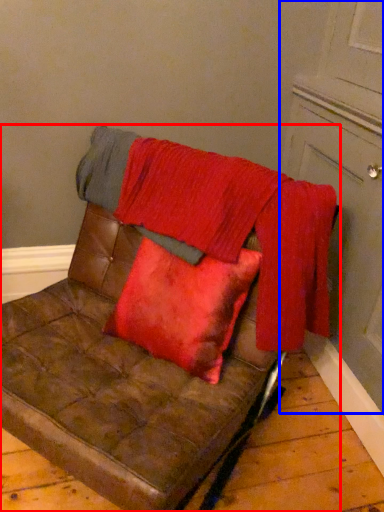
Question: Which of the following is the farthest to the observer, furniture (highlighted by a red box) or door (highlighted by a blue box)?

Choices:
 (A) furniture
 (B) door

Answer: (B)